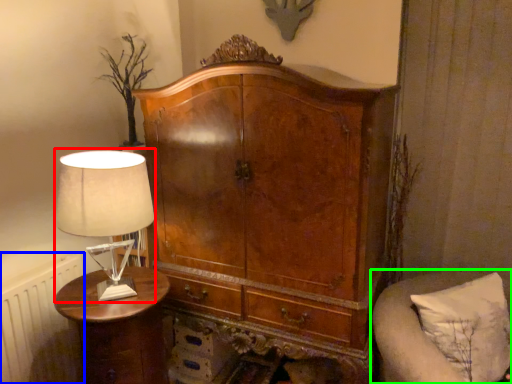
Question: Which is nearer to the table lamp (highlighted by a red box)? radiator (highlighted by a blue box) or furniture (highlighted by a green box).

Choices:
 (A) radiator
 (B) furniture

Answer: (A)